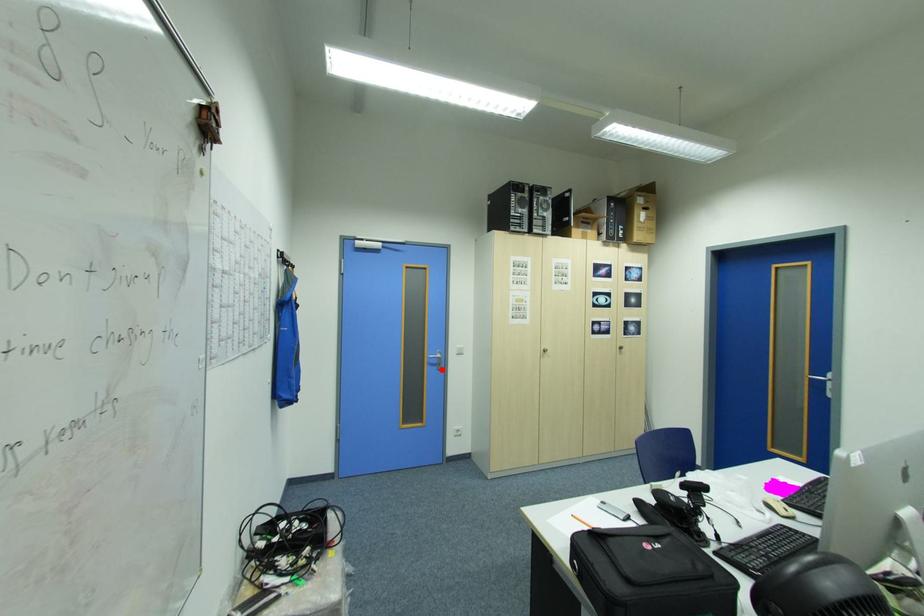
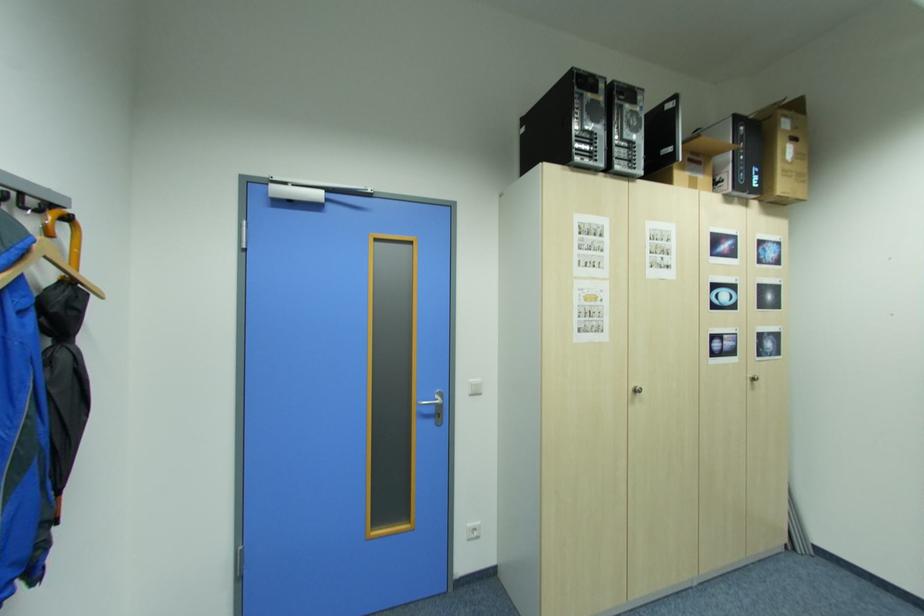
In the second image, find the point that corresponds to the highlighted location in the first image.

(438, 424)